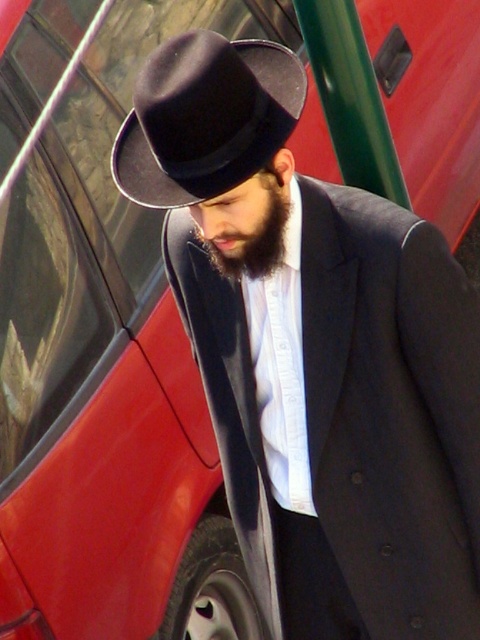
You are a photographer trying to capture the man in the scene. Since you want to focus on his facial features, you need to ensure that the black felt fedora at center does not block the dark brown fuzzy beard at center. Based on their positions, is this possible?

The black felt fedora at center is to the left of the dark brown fuzzy beard at center, so positioning the camera to the right side of the man would allow the beard to be visible without obstruction from the hat.

Based on the photo, what are the exact coordinates of the matte black hat at center in the image?

The matte black hat at center is located at point coordinates of (320, 358).